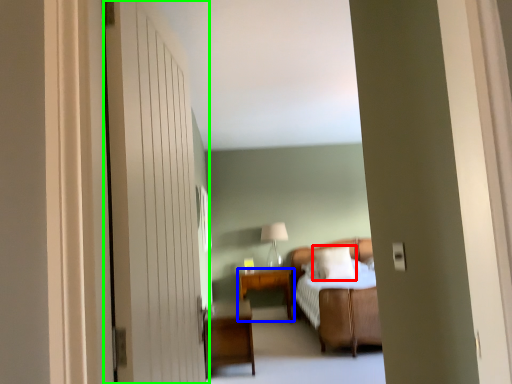
Question: Estimate the real-world distances between objects in this image. Which object is closer to pillow (highlighted by a red box), table (highlighted by a blue box) or door (highlighted by a green box)?

Choices:
 (A) table
 (B) door

Answer: (A)